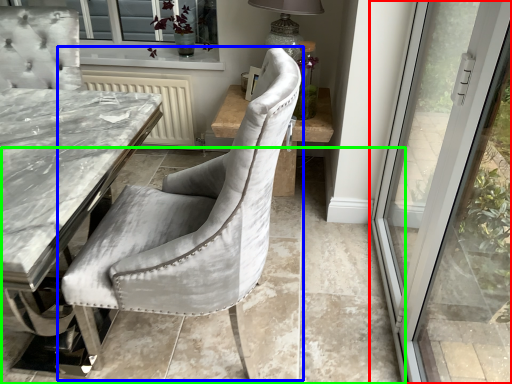
Question: Which object is positioned farthest from door (highlighted by a red box)? Select from chair (highlighted by a blue box) and concrete (highlighted by a green box).

Choices:
 (A) chair
 (B) concrete

Answer: (A)